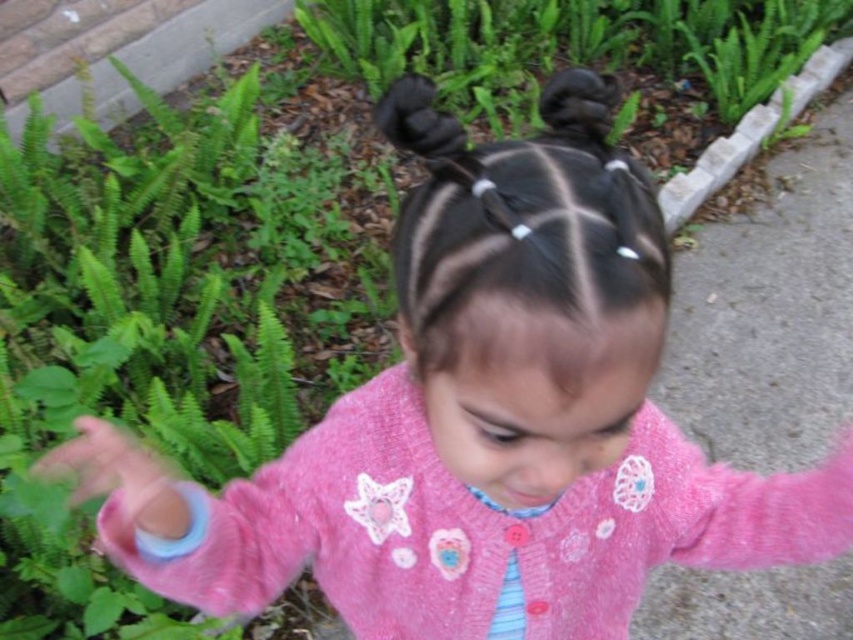
You are a photographer trying to capture the child in the scene. You notice the pink fabric hand at lower left and the black hair at upper center. Which object is positioned lower in the image?

The pink fabric hand at lower left is positioned lower than the black hair at upper center.

You are a photographer planning to take a portrait of the child in the garden. The pink fabric hand at lower left is an important element in the composition. To ensure it appears in the final shot, where should you position the camera relative to the child?

The pink fabric hand at lower left is located at coordinates point [119,476], so position the camera to the left side of the child to include the pink fabric hand at lower left in the frame.

You are a photographer capturing the scene. You notice the pink fabric hand at lower left and the black hair at upper center. Which object is closer to your camera lens?

The pink fabric hand at lower left is closer to the camera lens because it is further to the viewer than the black hair at upper center.